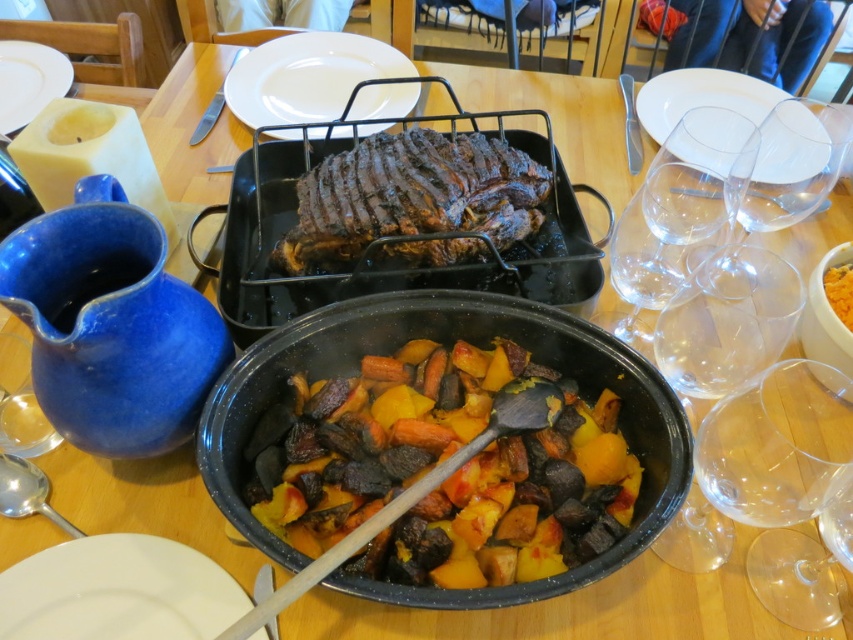
You are a guest at the table and want to choose the larger plate for your meal. Which plate should you pick between the white ceramic plate at lower left and the white ceramic plate at upper right?

The white ceramic plate at upper right is larger in size compared to the white ceramic plate at lower left, so you should pick the white ceramic plate at upper right.

You are a chef standing at the dining table and want to reach the black matte grill at center to check if the ribs are done. Your arm can extend 24 inches. Can you reach it?

The black matte grill at center is 24.73 inches away from the viewer. Since your arm can only extend 24 inches, you cannot reach it.